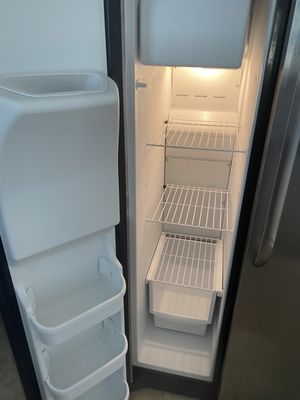
At what (x,y) coordinates should I click in order to perform the action: click on fridge shelf. Please return your answer as a coordinate pair (x, y). Looking at the image, I should click on (76, 304), (88, 346), (110, 389).